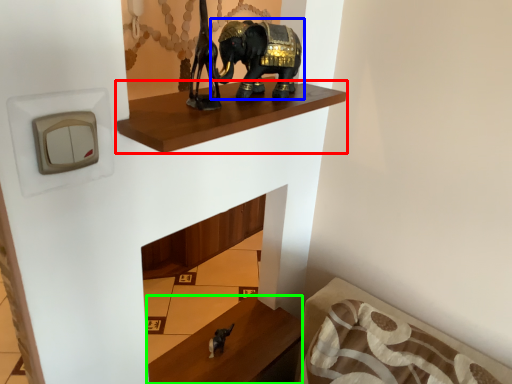
Question: Considering the real-world distances, which object is closest to shelf (highlighted by a red box)? elephant (highlighted by a blue box) or furniture (highlighted by a green box).

Choices:
 (A) elephant
 (B) furniture

Answer: (A)